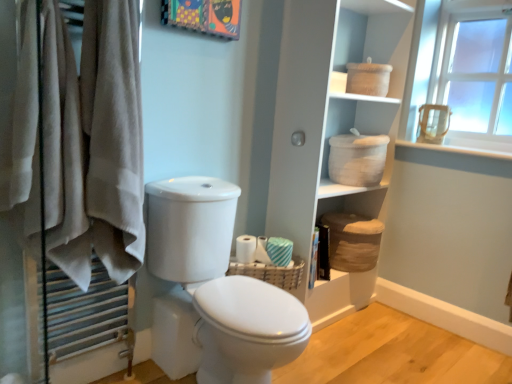
What are the coordinates of `free space above woven brown basket at center, arranged as the second basket when viewed from the right (from a real-world perspective)` in the screenshot? It's located at (266, 255).